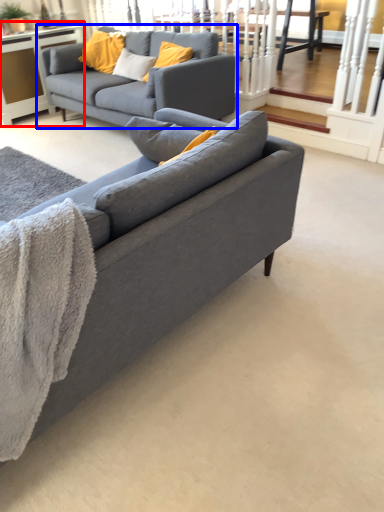
Question: Which of the following is the closest to the observer, table (highlighted by a red box) or studio couch (highlighted by a blue box)?

Choices:
 (A) table
 (B) studio couch

Answer: (B)